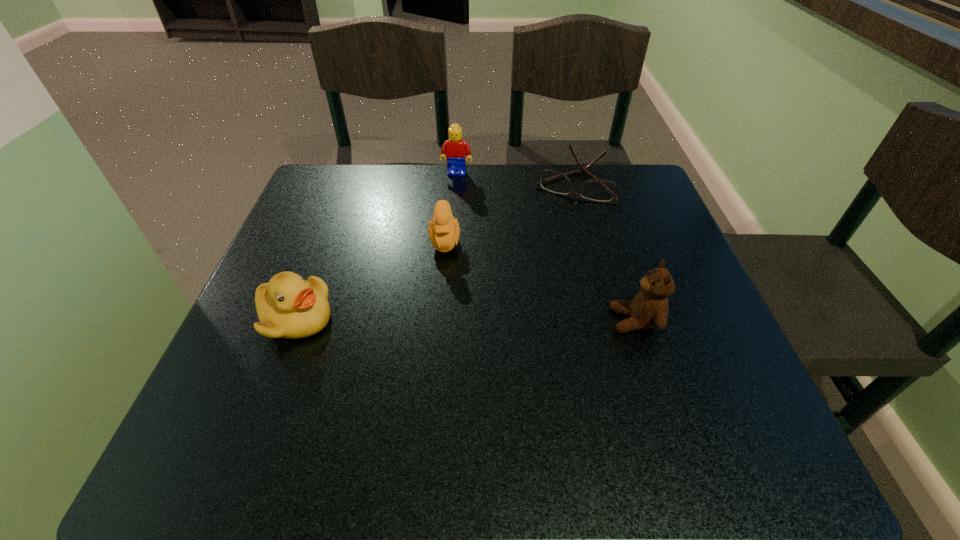
Identify the location of free space located 0.120m at the face of the teddy bear. (547, 321).

At what (x,y) coordinates should I click in order to perform the action: click on free region located on the face of the third farthest object. Please return your answer as a coordinate pair (x, y). Looking at the image, I should click on (450, 410).

In order to click on blank space located 0.270m on the face of the third farthest object in this screenshot , I will do `click(449, 367)`.

In order to click on vacant space located 0.300m on the face of the third farthest object in this screenshot , I will do `click(449, 382)`.

Identify the location of vacant space located 0.110m on the front-facing side of the shortest object. (553, 230).

You are a GUI agent. You are given a task and a screenshot of the screen. Output one action in this format:
    pyautogui.click(x=<x>, y=<y>)
    Task: Click on the vacant space located on the front-facing side of the shortest object
    
    Given the screenshot: What is the action you would take?
    pyautogui.click(x=539, y=262)

Locate an element on the screen. The width and height of the screenshot is (960, 540). blank space located 0.280m on the front-facing side of the shortest object is located at coordinates (533, 278).

Where is `free point located on the front-facing side of the Lego`? free point located on the front-facing side of the Lego is located at coordinates (452, 188).

This screenshot has height=540, width=960. In order to click on free location located 0.380m on the front-facing side of the Lego in this screenshot , I will do `click(429, 277)`.

Where is `vacant area located 0.050m on the front-facing side of the Lego`? Image resolution: width=960 pixels, height=540 pixels. vacant area located 0.050m on the front-facing side of the Lego is located at coordinates (452, 188).